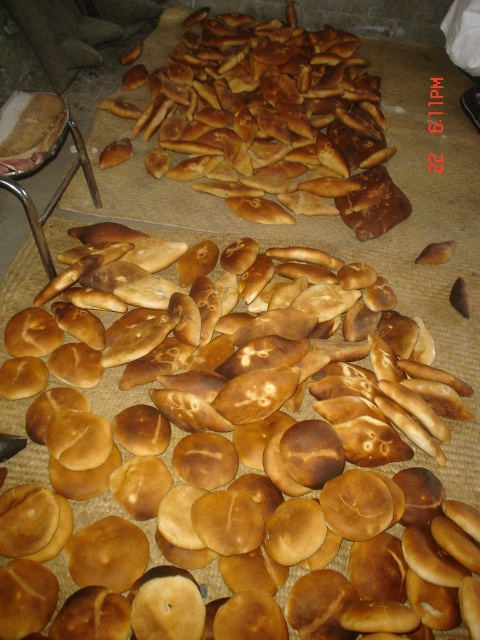
Looking at this image, you are standing in front of the bread display and want to pick up the bread located at point (148, 570) and the bread at point (180, 115). Which bread will you reach first?

The bread at point (148, 570) is closer to you than the bread at point (180, 115), so you will reach it first.

Looking at this image, you are a baker who wants to place a new bread on the table. You have a golden brown crusty bread at center and a golden brown flatbread at upper center. Which bread is closer to you?

The golden brown crusty bread at center is closer to you because it is in front of the golden brown flatbread at upper center.

You are a baker who needs to place a 3.5 feet long rolling pin between the golden brown crusty bread at center and the golden brown flatbread at upper center. Can the rolling pin fit between them?

The golden brown crusty bread at center is 3.36 feet away from the golden brown flatbread at upper center. Since the distance between them is less than the rolling pin length of 3.5 feet, the rolling pin cannot fit between them.